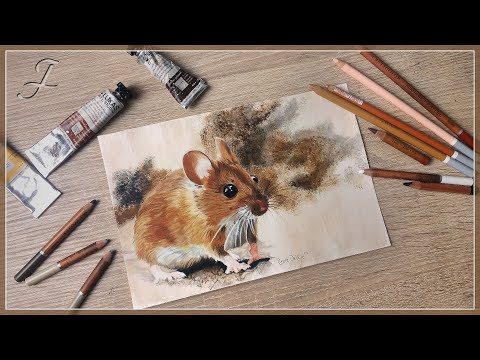
Where is `desktop`? The width and height of the screenshot is (480, 360). desktop is located at coordinates (426, 228).